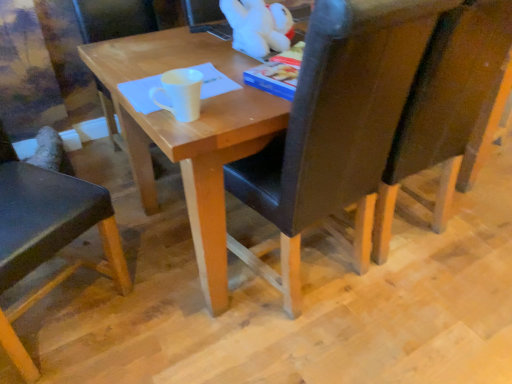
Find the location of a particular element. The image size is (512, 384). vacant space to the right of white matte mug at center is located at coordinates (240, 107).